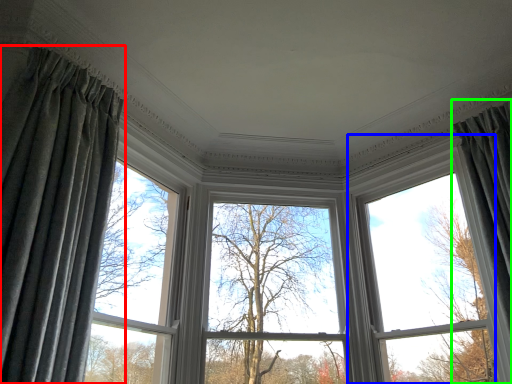
Question: Based on their relative distances, which object is nearer to curtain (highlighted by a red box)? Choose from bay window (highlighted by a blue box) and curtain (highlighted by a green box).

Choices:
 (A) bay window
 (B) curtain

Answer: (A)